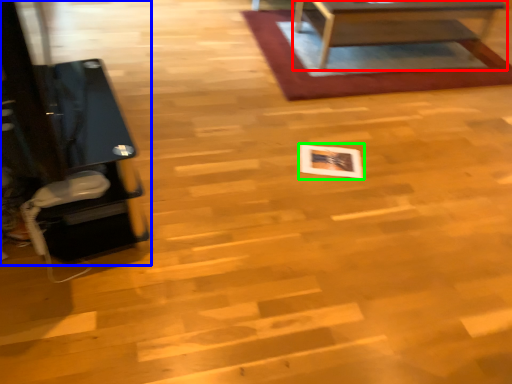
Question: Based on their relative distances, which object is farther from table (highlighted by a red box)? Choose from furniture (highlighted by a blue box) and square (highlighted by a green box).

Choices:
 (A) furniture
 (B) square

Answer: (A)